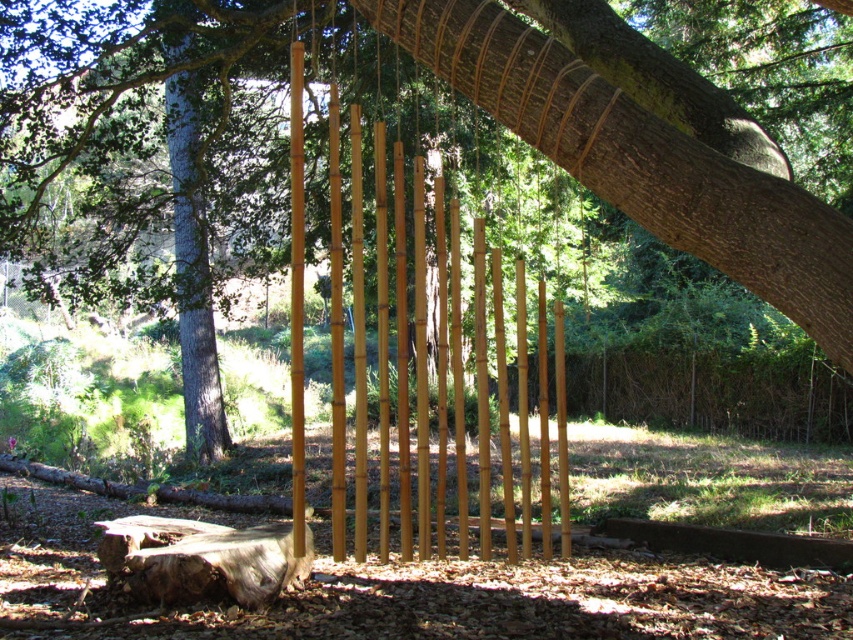
You are standing in the garden and want to place a small decorative stone between the two points, point [575,60] and point [799,348]. Which point should you place the stone closer to in order to ensure it is visible from your current position?

You should place the stone closer to point [575,60] because it is closer to the viewer than point [799,348], making it more visible from your current position.

You are standing in the garden and want to see the smooth gray bark at center clearly. Since the brown wooden fence at center is blocking your view, can you move around it to get a better look?

The smooth gray bark at center is behind the brown wooden fence at center, so you would need to move behind the brown wooden fence at center to see it clearly. However, since the fence is blocking the view from your current position, you might need to go around to the other side of the brown wooden fence at center where the smooth gray bark at center is located.

You are standing in the garden and want to place a small statue between the two points labeled point (x=846, y=406) and point (x=194, y=168). Which point should the statue be closer to in order to be closer to the viewer?

The statue should be closer to point (x=846, y=406) because it is further to the viewer than point (x=194, y=168).